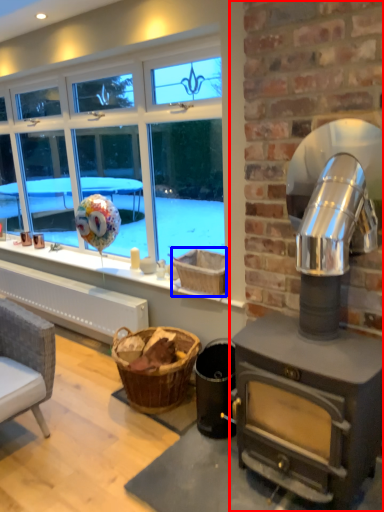
Question: Among these objects, which one is nearest to the camera, fireplace (highlighted by a red box) or basket (highlighted by a blue box)?

Choices:
 (A) fireplace
 (B) basket

Answer: (A)